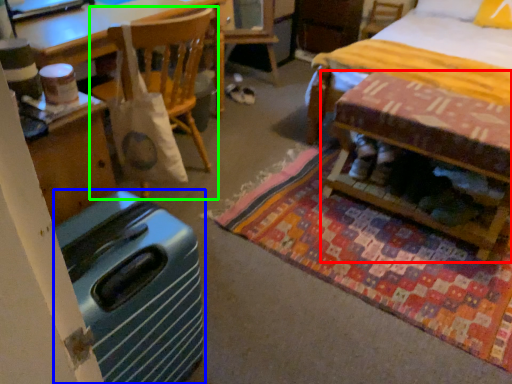
Question: Which object is positioned farthest from table (highlighted by a red box)? Select from luggage (highlighted by a blue box) and chair (highlighted by a green box).

Choices:
 (A) luggage
 (B) chair

Answer: (A)